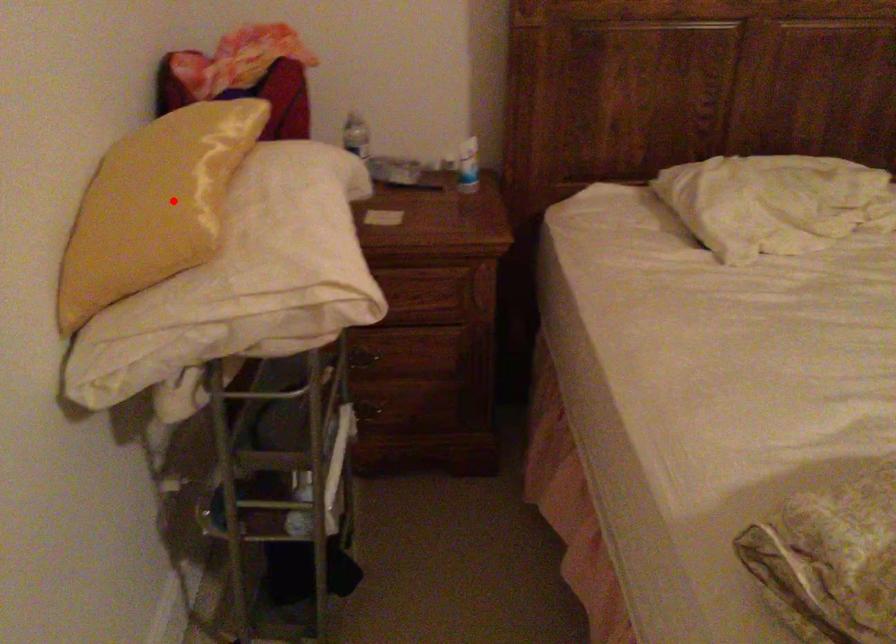
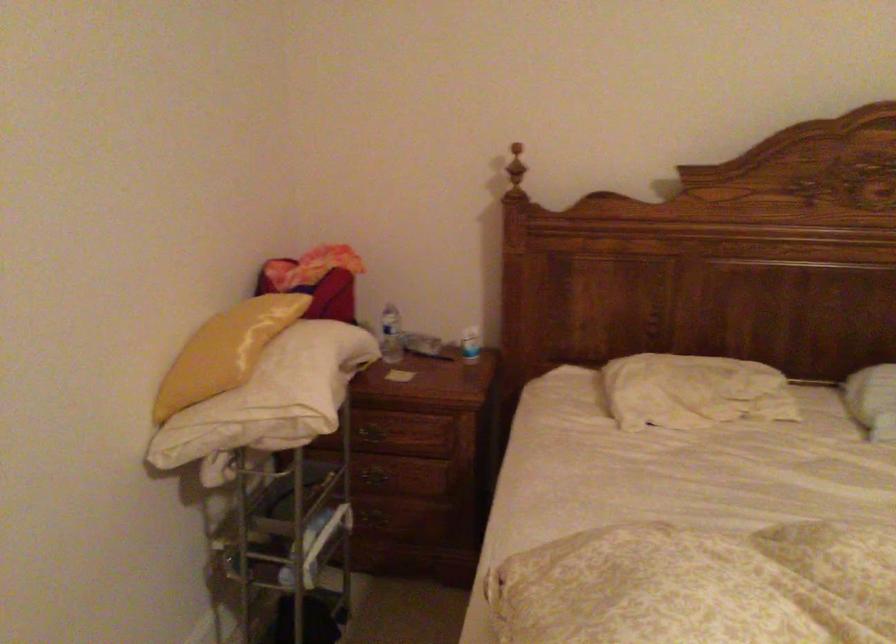
Locate, in the second image, the point that corresponds to the highlighted location in the first image.

(225, 351)